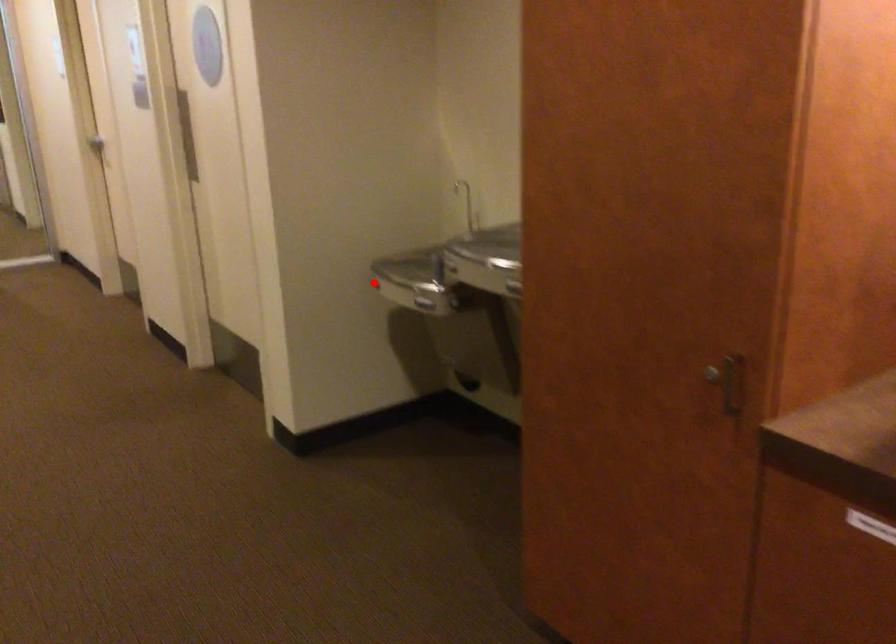
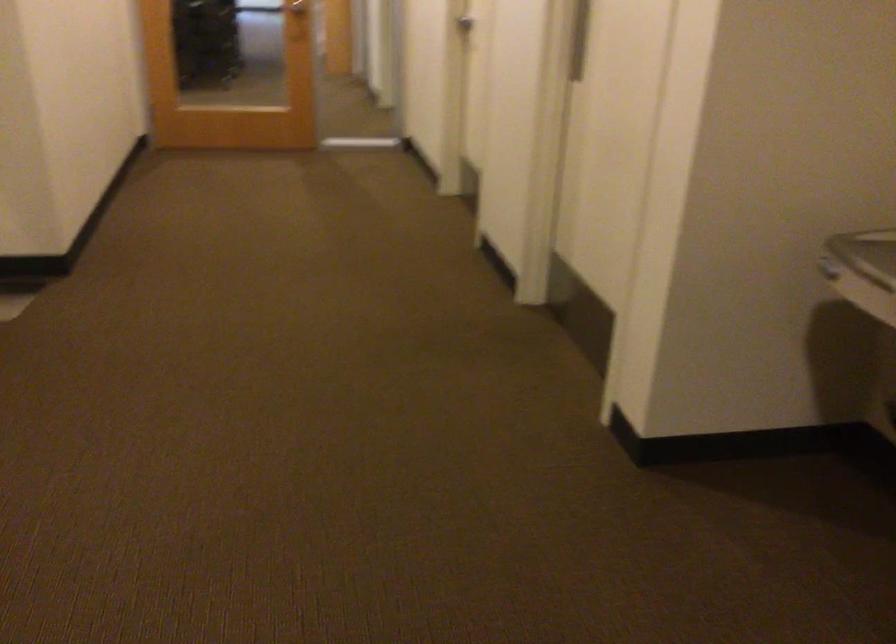
Question: I am providing you with two images of the same scene from different viewpoints. In image1, a red point is highlighted. Considering the same 3D point in image2, which of the following is correct?

Choices:
 (A) It is closer
 (B) It is farther

Answer: (A)